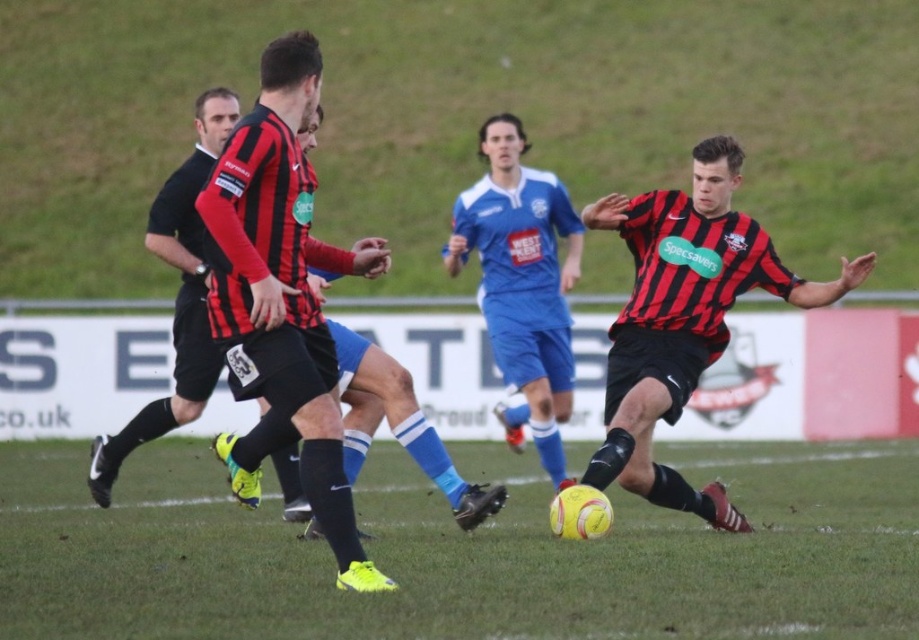
Question: Among these objects, which one is nearest to the camera?

Choices:
 (A) yellow rubber ball at center
 (B) matte black jersey at center

Answer: (A)

Question: Does yellow rubber ball at center appear on the right side of matte black jersey at center?

Choices:
 (A) yes
 (B) no

Answer: (B)

Question: Which point is farther to the camera?

Choices:
 (A) (608, 211)
 (B) (708, 538)

Answer: (A)

Question: Can you confirm if yellow rubber ball at center is bigger than matte black jersey at center?

Choices:
 (A) no
 (B) yes

Answer: (B)

Question: Can you confirm if yellow rubber ball at center is thinner than matte black jersey at center?

Choices:
 (A) no
 (B) yes

Answer: (A)